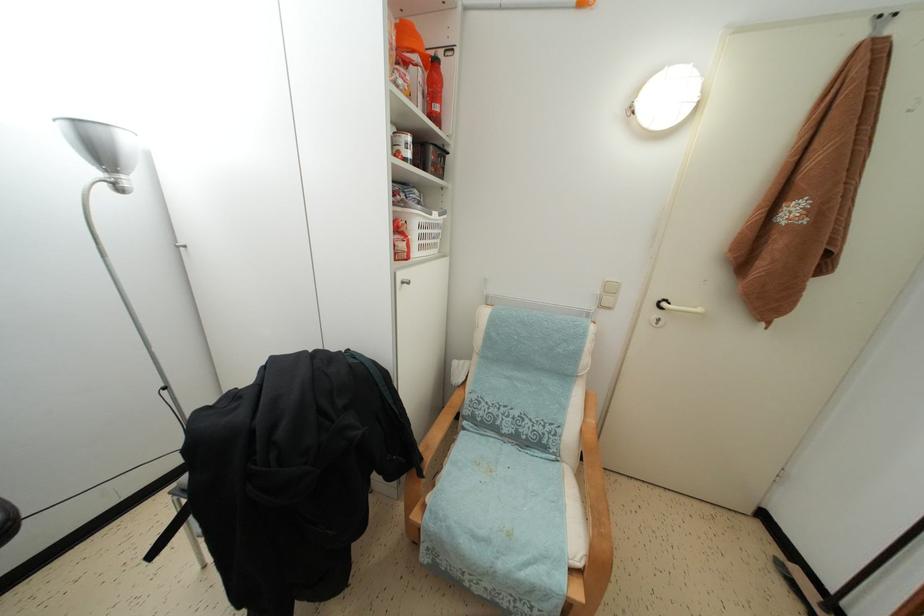
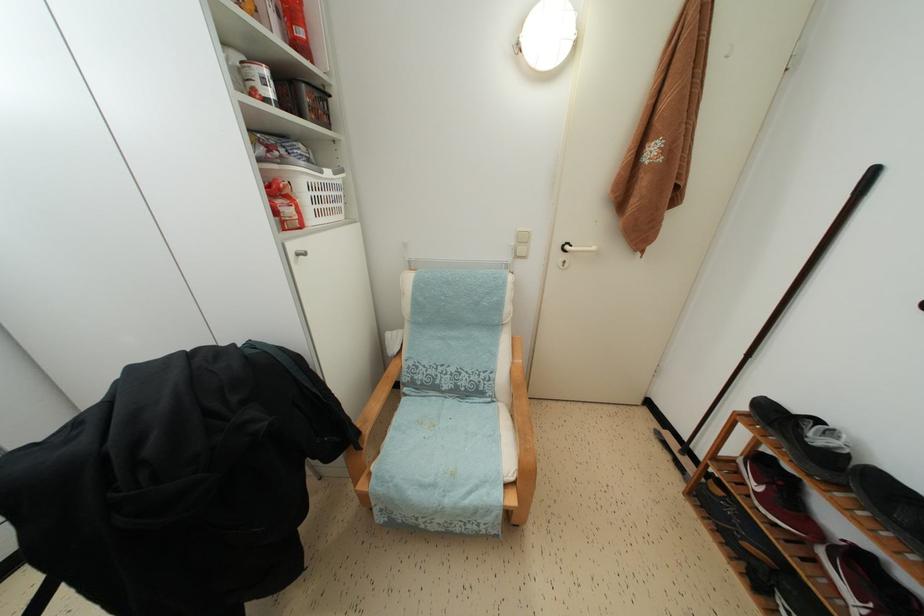
In the second image, find the point that corresponds to (x=766, y=270) in the first image.

(638, 207)